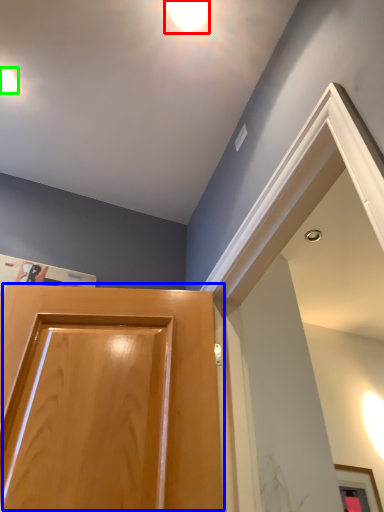
Question: Which object is positioned closest to droplight (highlighted by a red box)? Select from door (highlighted by a blue box) and droplight (highlighted by a green box).

Choices:
 (A) door
 (B) droplight

Answer: (B)